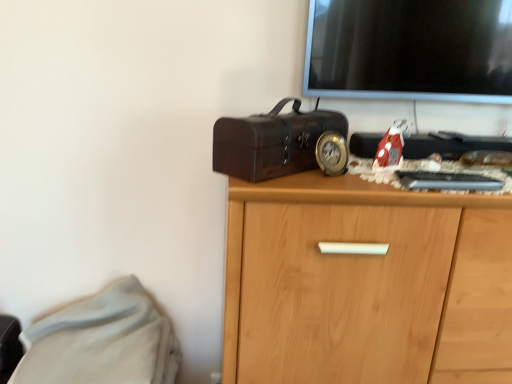
Question: Is white soft fabric at lower left closer to the viewer compared to light wood cabinet at center?

Choices:
 (A) yes
 (B) no

Answer: (B)

Question: From the image's perspective, would you say white soft fabric at lower left is shown under light wood cabinet at center?

Choices:
 (A) yes
 (B) no

Answer: (A)

Question: Is white soft fabric at lower left outside light wood cabinet at center?

Choices:
 (A) no
 (B) yes

Answer: (B)

Question: Does white soft fabric at lower left have a smaller size compared to light wood cabinet at center?

Choices:
 (A) no
 (B) yes

Answer: (B)

Question: Does white soft fabric at lower left have a lesser height compared to light wood cabinet at center?

Choices:
 (A) yes
 (B) no

Answer: (A)

Question: Is white soft fabric at lower left to the left or to the right of light wood cabinet at center in the image?

Choices:
 (A) left
 (B) right

Answer: (A)

Question: In the image, is white soft fabric at lower left positioned in front of or behind light wood cabinet at center?

Choices:
 (A) front
 (B) behind

Answer: (B)

Question: Based on their sizes in the image, would you say white soft fabric at lower left is bigger or smaller than light wood cabinet at center?

Choices:
 (A) small
 (B) big

Answer: (A)

Question: Is white soft fabric at lower left spatially inside light wood cabinet at center, or outside of it?

Choices:
 (A) inside
 (B) outside

Answer: (B)

Question: From the image's perspective, is light wood cabinet at center above or below shiny dark brown suitcase at center?

Choices:
 (A) above
 (B) below

Answer: (B)

Question: Is light wood cabinet at center to the left or to the right of shiny dark brown suitcase at center in the image?

Choices:
 (A) right
 (B) left

Answer: (A)

Question: From their relative heights in the image, would you say light wood cabinet at center is taller or shorter than shiny dark brown suitcase at center?

Choices:
 (A) short
 (B) tall

Answer: (B)

Question: Is point (387, 299) closer or farther from the camera than point (234, 165)?

Choices:
 (A) closer
 (B) farther

Answer: (B)

Question: From a real-world perspective, relative to white soft fabric at lower left, is light wood cabinet at center vertically above or below?

Choices:
 (A) below
 (B) above

Answer: (B)

Question: Is light wood cabinet at center inside the boundaries of white soft fabric at lower left, or outside?

Choices:
 (A) outside
 (B) inside

Answer: (A)